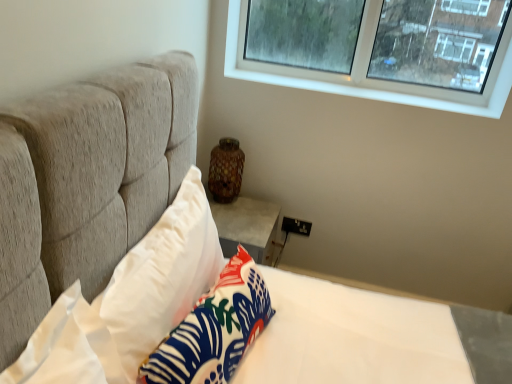
Question: Is clear glass window at upper right completely or partially outside of white fabric pillow at lower center, the first pillow from the right?

Choices:
 (A) no
 (B) yes

Answer: (B)

Question: Is clear glass window at upper right wider than white fabric pillow at lower center, the first pillow from the right?

Choices:
 (A) yes
 (B) no

Answer: (B)

Question: Is clear glass window at upper right beside white fabric pillow at lower center, the 2th pillow when ordered from left to right?

Choices:
 (A) yes
 (B) no

Answer: (B)

Question: Does clear glass window at upper right have a greater height compared to white fabric pillow at lower center, the first pillow from the right?

Choices:
 (A) yes
 (B) no

Answer: (A)

Question: Is clear glass window at upper right bigger than white fabric pillow at lower center, the 2th pillow when ordered from left to right?

Choices:
 (A) yes
 (B) no

Answer: (A)

Question: Could you tell me if clear glass window at upper right is turned towards white fabric pillow at lower center, the first pillow from the right?

Choices:
 (A) no
 (B) yes

Answer: (A)

Question: Would you say clear glass window at upper right contains brown speckled ceramic vase at center?

Choices:
 (A) no
 (B) yes

Answer: (A)

Question: Is clear glass window at upper right smaller than brown speckled ceramic vase at center?

Choices:
 (A) no
 (B) yes

Answer: (A)

Question: From the image's perspective, is clear glass window at upper right located beneath brown speckled ceramic vase at center?

Choices:
 (A) yes
 (B) no

Answer: (B)

Question: Considering the relative positions of clear glass window at upper right and brown speckled ceramic vase at center in the image provided, is clear glass window at upper right to the left of brown speckled ceramic vase at center from the viewer's perspective?

Choices:
 (A) yes
 (B) no

Answer: (B)

Question: Does clear glass window at upper right have a greater width compared to brown speckled ceramic vase at center?

Choices:
 (A) no
 (B) yes

Answer: (A)

Question: Is clear glass window at upper right bigger than brown speckled ceramic vase at center?

Choices:
 (A) no
 (B) yes

Answer: (B)

Question: Can you confirm if white smooth stone at upper right is wider than brown speckled ceramic vase at center?

Choices:
 (A) no
 (B) yes

Answer: (B)